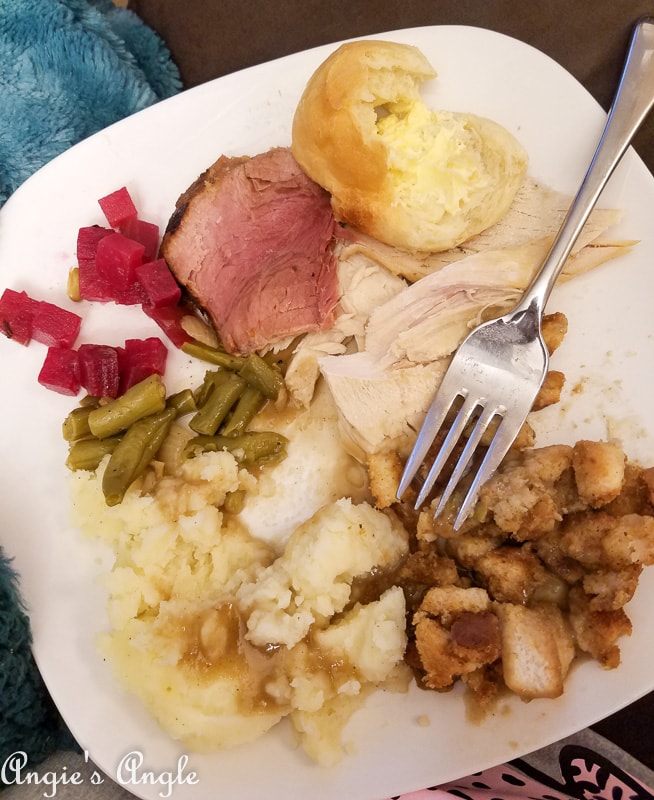
The height and width of the screenshot is (800, 654). I want to click on brown tabletop, so click(x=250, y=45).